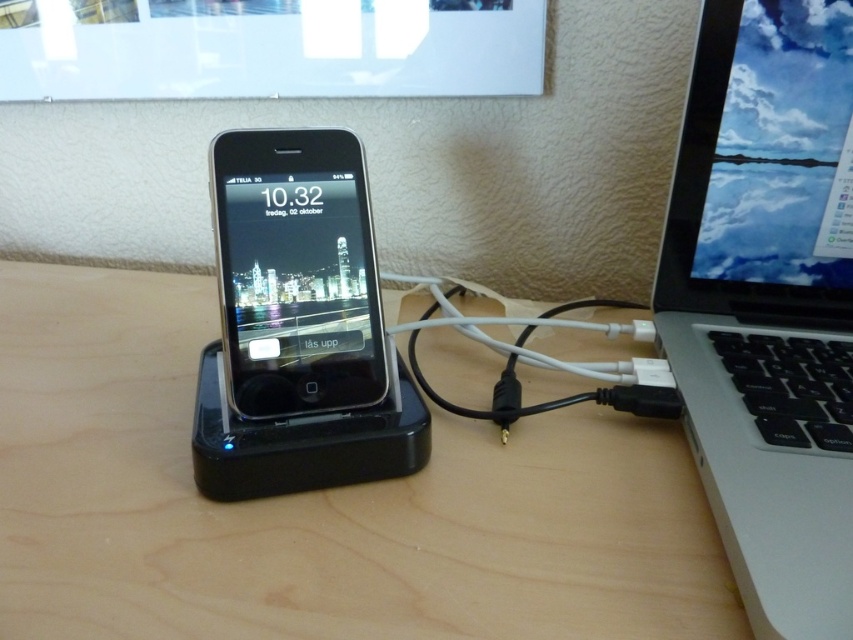
Question: Which is farther from the black glossy ipod at center?

Choices:
 (A) wooden table at center
 (B) silver metallic laptop at right

Answer: (B)

Question: Is wooden table at center above silver metallic laptop at right?

Choices:
 (A) yes
 (B) no

Answer: (B)

Question: Is silver metallic laptop at right wider than black matte cable at center?

Choices:
 (A) yes
 (B) no

Answer: (B)

Question: Which object is positioned closest to the wooden table at center?

Choices:
 (A) silver metallic laptop at right
 (B) black matte cable at center
 (C) black glossy ipod at center

Answer: (B)

Question: Which point is farther to the camera?

Choices:
 (A) black matte cable at center
 (B) wooden table at center

Answer: (A)

Question: Can you confirm if black glossy ipod at center is thinner than black matte cable at center?

Choices:
 (A) no
 (B) yes

Answer: (B)